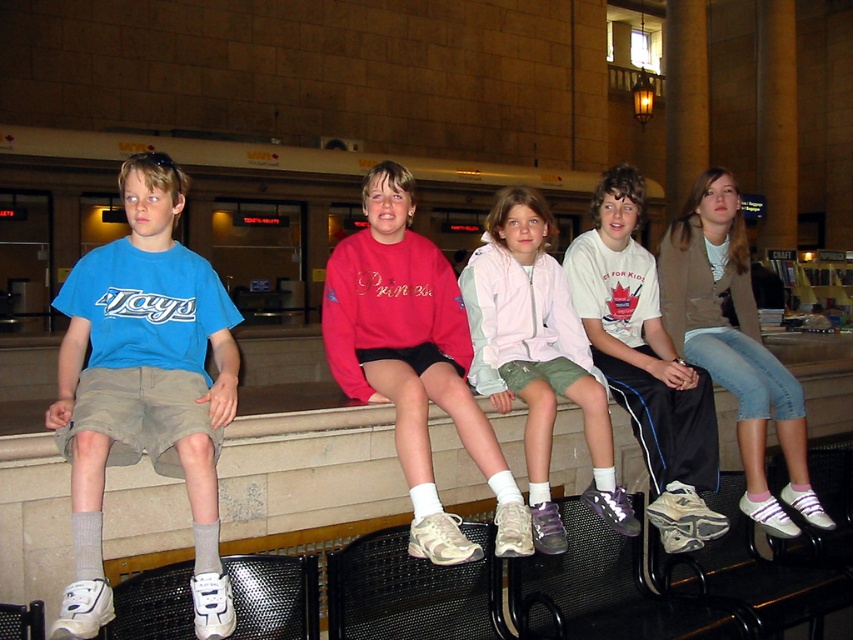
Question: Does matte pink sweatshirt at center have a smaller size compared to white athletic shoe at center?

Choices:
 (A) yes
 (B) no

Answer: (B)

Question: Does matte blue t-shirt at left have a smaller size compared to light pink fabric jacket at center?

Choices:
 (A) no
 (B) yes

Answer: (A)

Question: Does matte blue t-shirt at left have a lesser width compared to matte pink sweatshirt at center?

Choices:
 (A) yes
 (B) no

Answer: (A)

Question: Among these objects, which one is nearest to the camera?

Choices:
 (A) matte blue t-shirt at left
 (B) light pink fabric jacket at center
 (C) matte pink sweatshirt at center

Answer: (A)

Question: Which point is closer to the camera taking this photo?

Choices:
 (A) (506, 477)
 (B) (201, 442)
 (C) (534, 310)

Answer: (B)

Question: Based on their relative distances, which object is farther from the light pink fabric jacket at center?

Choices:
 (A) white athletic shoe at center
 (B) matte pink sweatshirt at center
 (C) matte blue t-shirt at left

Answer: (C)